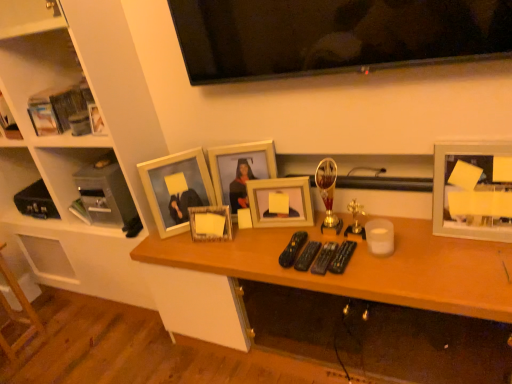
Locate an element on the screen. Image resolution: width=512 pixels, height=384 pixels. free space on the front side of wooden picture frame at center, the 4th picture frame in the right-to-left sequence is located at coordinates (223, 252).